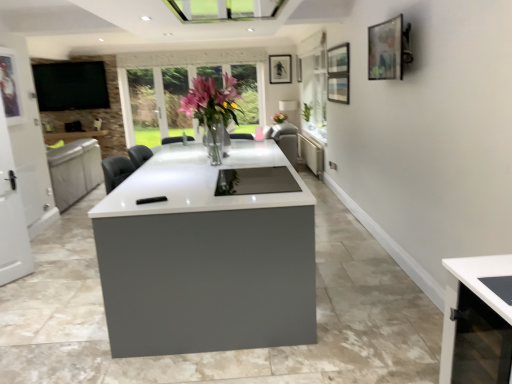
Question: Would you say matte black tv at upper left is a long distance from matte black picture frame at upper center, which ranks as the fourth picture frame in bottom-to-top order?

Choices:
 (A) yes
 (B) no

Answer: (A)

Question: Can you confirm if matte black tv at upper left is taller than matte black picture frame at upper center, which is counted as the 1th picture frame, starting from the top?

Choices:
 (A) yes
 (B) no

Answer: (A)

Question: Is matte black tv at upper left to the left of matte black picture frame at upper center, which ranks as the fourth picture frame in front-to-back order, from the viewer's perspective?

Choices:
 (A) no
 (B) yes

Answer: (B)

Question: Is the surface of matte black tv at upper left in direct contact with matte black picture frame at upper center, the 2th picture frame viewed from the left?

Choices:
 (A) no
 (B) yes

Answer: (A)

Question: Can you confirm if matte black tv at upper left is wider than matte black picture frame at upper center, the 2th picture frame viewed from the left?

Choices:
 (A) no
 (B) yes

Answer: (B)

Question: In terms of width, does translucent glass vase at center look wider or thinner when compared to matte black tv at upper left?

Choices:
 (A) wide
 (B) thin

Answer: (A)

Question: Based on their sizes in the image, would you say translucent glass vase at center is bigger or smaller than matte black tv at upper left?

Choices:
 (A) small
 (B) big

Answer: (A)

Question: From the image's perspective, is translucent glass vase at center above or below matte black tv at upper left?

Choices:
 (A) below
 (B) above

Answer: (A)

Question: From a real-world perspective, is translucent glass vase at center positioned above or below matte black tv at upper left?

Choices:
 (A) below
 (B) above

Answer: (A)

Question: Is matte black picture frame at upper center, which ranks as the fourth picture frame in front-to-back order, taller or shorter than metallic silver picture frame at left, the 4th picture frame viewed from the right?

Choices:
 (A) short
 (B) tall

Answer: (A)

Question: In terms of size, does matte black picture frame at upper center, positioned as the 1th picture frame in back-to-front order, appear bigger or smaller than metallic silver picture frame at left, which appears as the 1th picture frame when ordered from the bottom?

Choices:
 (A) small
 (B) big

Answer: (A)

Question: Is point (283, 59) positioned closer to the camera than point (10, 52)?

Choices:
 (A) farther
 (B) closer

Answer: (A)

Question: From the image's perspective, is matte black picture frame at upper center, the 2th picture frame viewed from the left, located above or below metallic silver picture frame at left, the 4th picture frame viewed from the right?

Choices:
 (A) above
 (B) below

Answer: (A)

Question: Is metallic silver picture frame at left, which appears as the 1th picture frame when ordered from the bottom, in front of or behind matte gray radiator at center in the image?

Choices:
 (A) behind
 (B) front

Answer: (B)

Question: Considering the relative positions of metallic silver picture frame at left, which is the 3th picture frame from back to front, and matte gray radiator at center in the image provided, is metallic silver picture frame at left, which is the 3th picture frame from back to front, to the left or to the right of matte gray radiator at center?

Choices:
 (A) right
 (B) left

Answer: (B)